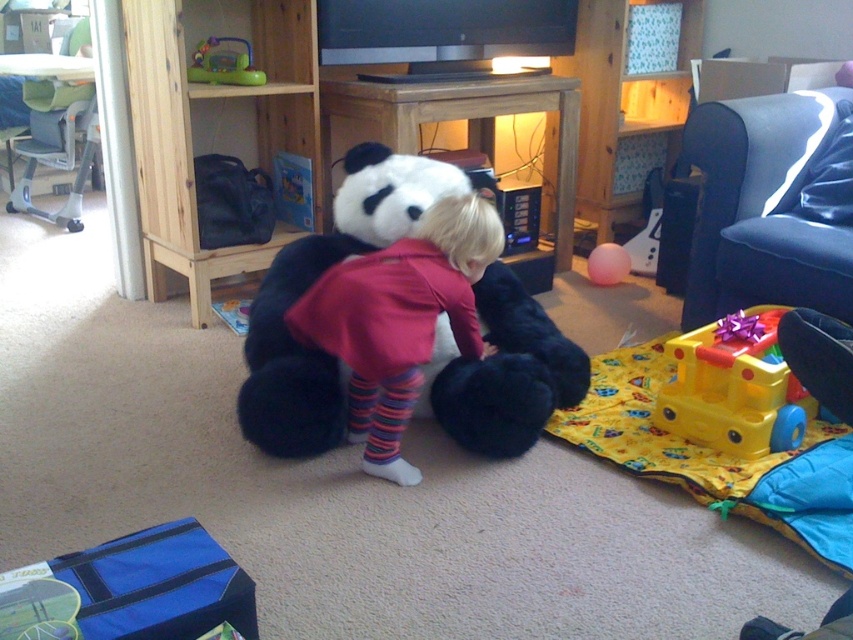
Can you confirm if yellow plastic train at lower right is positioned to the left of green plastic toy at upper left?

Incorrect, yellow plastic train at lower right is not on the left side of green plastic toy at upper left.

Is point (657, 406) positioned after point (201, 45)?

That is False.

You are a GUI agent. You are given a task and a screenshot of the screen. Output one action in this format:
    pyautogui.click(x=<x>, y=<y>)
    Task: Click on the yellow plastic train at lower right
    The width and height of the screenshot is (853, 640).
    Given the screenshot: What is the action you would take?
    pyautogui.click(x=734, y=390)

Does point (372, 468) come behind point (229, 38)?

No, (372, 468) is closer to viewer.

Is soft plush panda at center to the right of green plastic toy at upper left from the viewer's perspective?

Indeed, soft plush panda at center is positioned on the right side of green plastic toy at upper left.

The width and height of the screenshot is (853, 640). In order to click on soft plush panda at center in this screenshot , I will do `click(399, 320)`.

Does green plastic toy at upper left have a lesser height compared to rubber ball at center?

In fact, green plastic toy at upper left may be taller than rubber ball at center.

This screenshot has height=640, width=853. What do you see at coordinates (223, 64) in the screenshot? I see `green plastic toy at upper left` at bounding box center [223, 64].

This screenshot has width=853, height=640. I want to click on green plastic toy at upper left, so click(x=223, y=64).